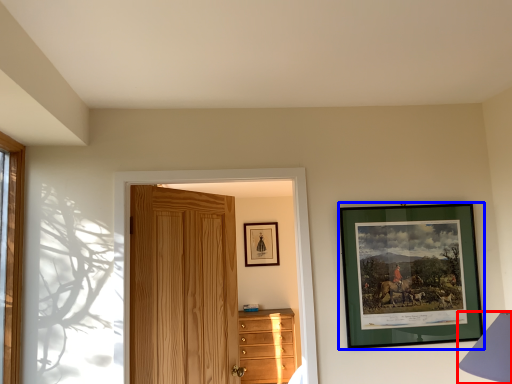
Question: Which object appears farthest to the camera in this image, table lamp (highlighted by a red box) or picture frame (highlighted by a blue box)?

Choices:
 (A) table lamp
 (B) picture frame

Answer: (B)